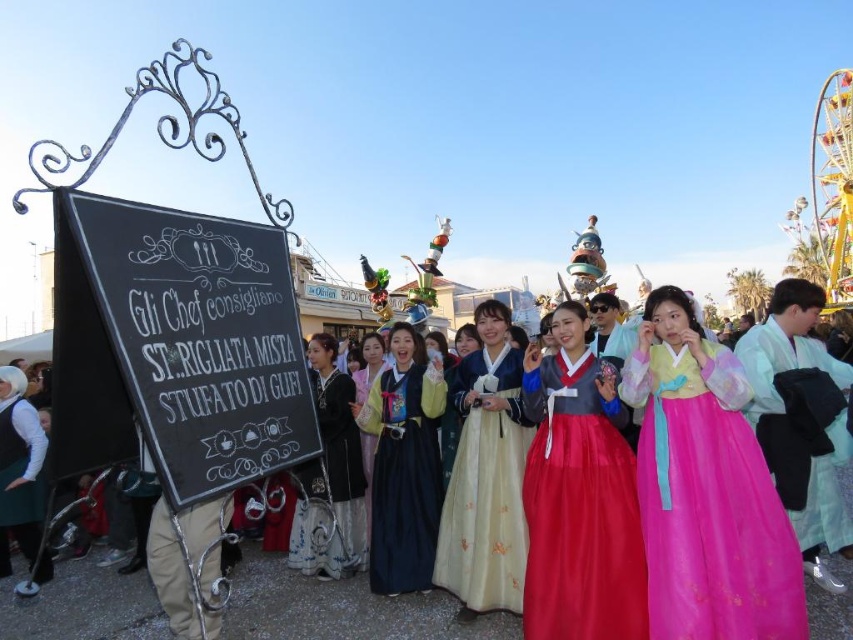
Question: Considering the real-world distances, which object is farthest from the red satin dress at center?

Choices:
 (A) yellow satin dress at center
 (B) silk blue dress at center

Answer: (B)

Question: Based on their relative distances, which object is farther from the light blue silk kimono at center?

Choices:
 (A) red satin dress at center
 (B) silk blue dress at center
 (C) yellow satin dress at center

Answer: (B)

Question: Considering the relative positions of red satin dress at center and dark green fabric dress at lower left in the image provided, where is red satin dress at center located with respect to dark green fabric dress at lower left?

Choices:
 (A) below
 (B) above

Answer: (B)

Question: Considering the real-world distances, which object is closest to the red satin dress at center?

Choices:
 (A) dark green fabric dress at lower left
 (B) light blue silk kimono at center
 (C) matte black dress at center
 (D) silk blue dress at center

Answer: (C)

Question: Is pink satin dress at center to the right of silk blue dress at center from the viewer's perspective?

Choices:
 (A) yes
 (B) no

Answer: (A)

Question: Is the position of black chalkboard at left more distant than that of red satin dress at center?

Choices:
 (A) yes
 (B) no

Answer: (B)